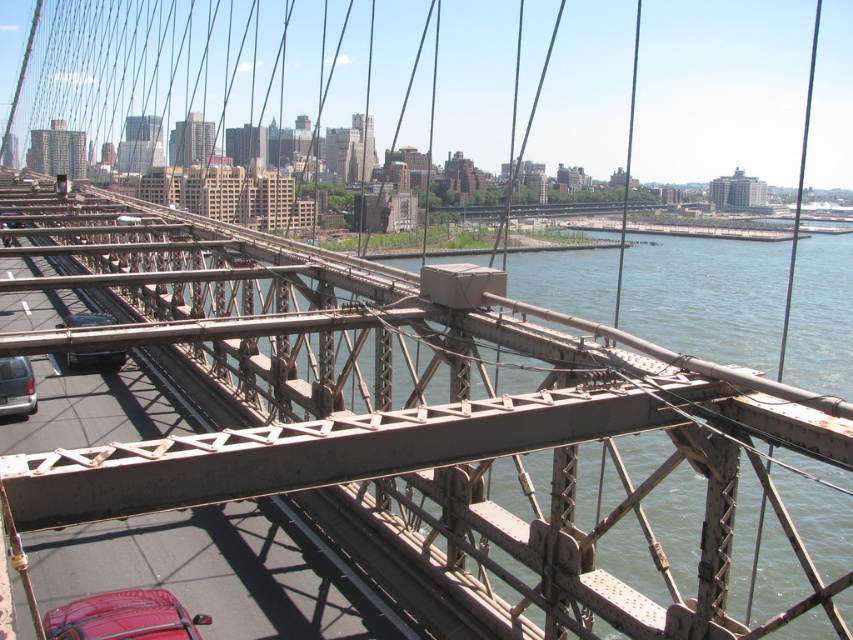
Does metallic gray bridge at center have a smaller size compared to metallic red car at lower left?

No.

From the picture: Is metallic gray bridge at center thinner than metallic red car at lower left?

Incorrect, metallic gray bridge at center's width is not less than metallic red car at lower left's.

This screenshot has width=853, height=640. What do you see at coordinates (408, 420) in the screenshot?
I see `metallic gray bridge at center` at bounding box center [408, 420].

Identify the location of metallic gray bridge at center. (408, 420).

Does metallic gray bridge at center have a greater height compared to matte black car at lower left?

Yes, metallic gray bridge at center is taller than matte black car at lower left.

Which is behind, point (376, 384) or point (71, 324)?

The point (71, 324) is behind.

Where is `metallic gray bridge at center`? The image size is (853, 640). metallic gray bridge at center is located at coordinates (408, 420).

Where is `metallic gray bridge at center`? The height and width of the screenshot is (640, 853). metallic gray bridge at center is located at coordinates (408, 420).

Does metallic red car at lower left appear under matte black van at left?

Correct, metallic red car at lower left is located below matte black van at left.

Who is more forward, (144, 621) or (16, 397)?

Point (144, 621)

Is point (126, 612) closer to camera compared to point (20, 380)?

That is True.

Locate an element on the screen. This screenshot has height=640, width=853. metallic red car at lower left is located at coordinates (123, 618).